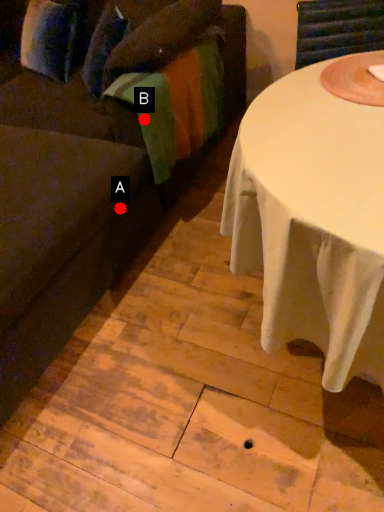
Question: Two points are circled on the image, labeled by A and B beside each circle. Which point appears closest to the camera in this image?

Choices:
 (A) A is closer
 (B) B is closer

Answer: (A)